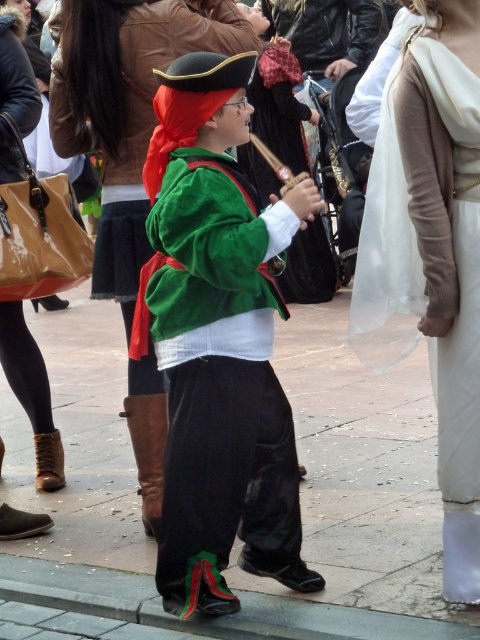
Between smooth concrete pavement at center and velvet green jacket at center, which one has less height?

With less height is smooth concrete pavement at center.

Is the position of smooth concrete pavement at center more distant than that of velvet green jacket at center?

Yes.

Identify the location of smooth concrete pavement at center. (237, 540).

Who is more forward, (402, 387) or (383, 150)?

Point (383, 150) is more forward.

Can you confirm if smooth concrete pavement at center is bigger than white satin dress at center?

Actually, smooth concrete pavement at center might be smaller than white satin dress at center.

The image size is (480, 640). Identify the location of smooth concrete pavement at center. (237, 540).

Can you confirm if velvet green jacket at center is taller than white satin dress at center?

Incorrect, velvet green jacket at center's height is not larger of white satin dress at center's.

Can you confirm if velvet green jacket at center is thinner than white satin dress at center?

No.

What are the coordinates of `velvet green jacket at center` in the screenshot? It's located at (217, 342).

Image resolution: width=480 pixels, height=640 pixels. In order to click on velvet green jacket at center in this screenshot , I will do `click(217, 342)`.